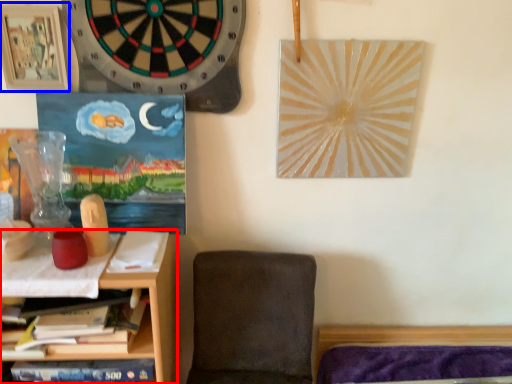
Question: Which object appears closest to the camera in this image, shelf (highlighted by a red box) or picture frame (highlighted by a blue box)?

Choices:
 (A) shelf
 (B) picture frame

Answer: (A)